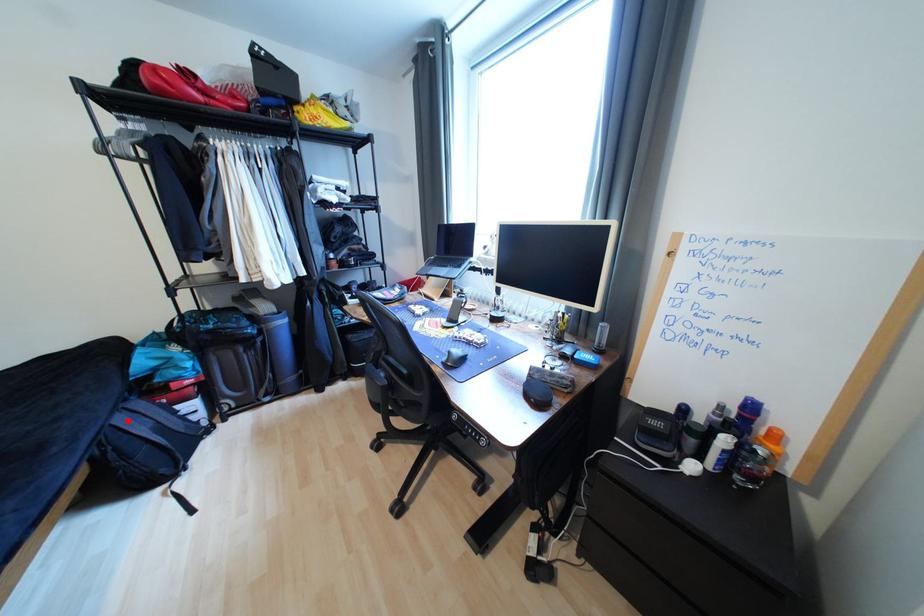
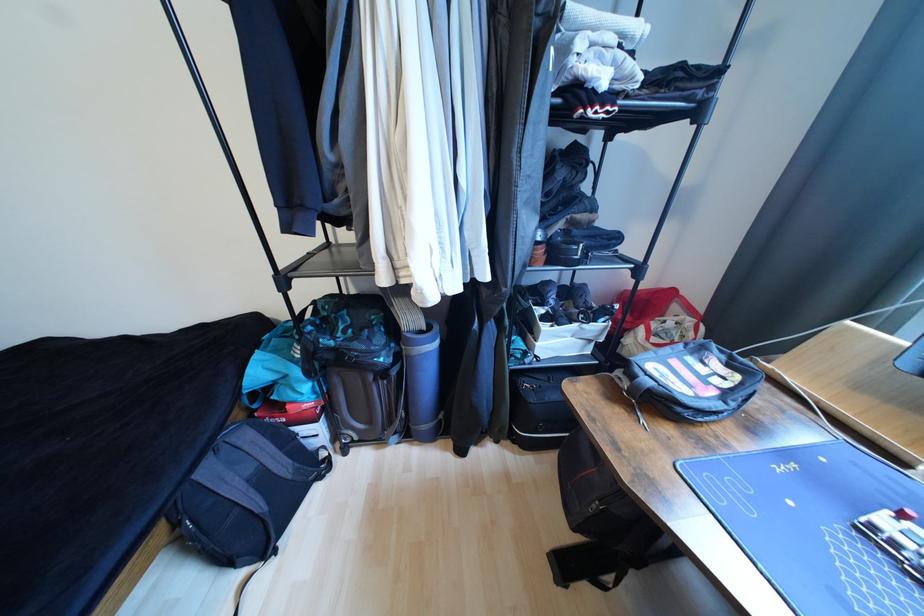
Locate, in the second image, the point that corresponds to the highlighted location in the first image.

(215, 472)